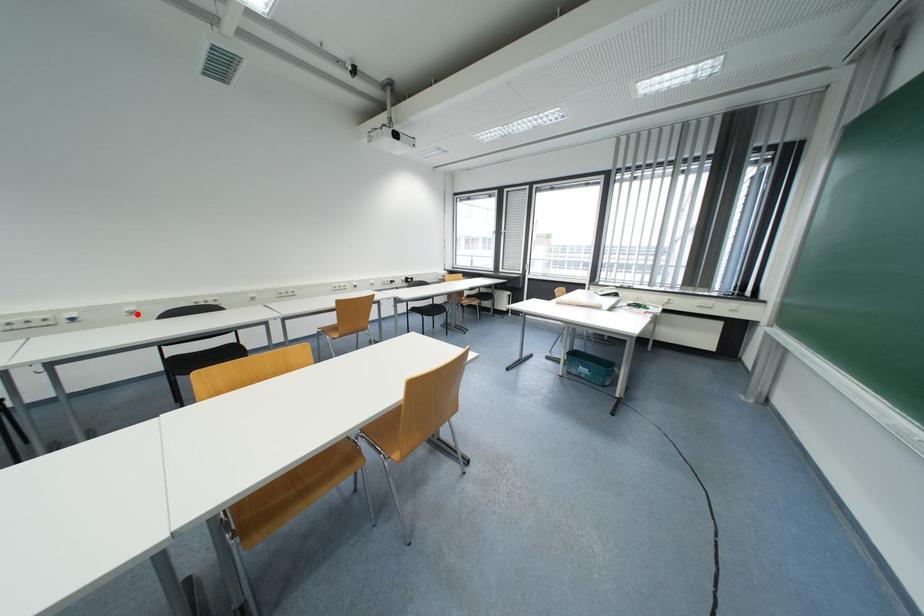
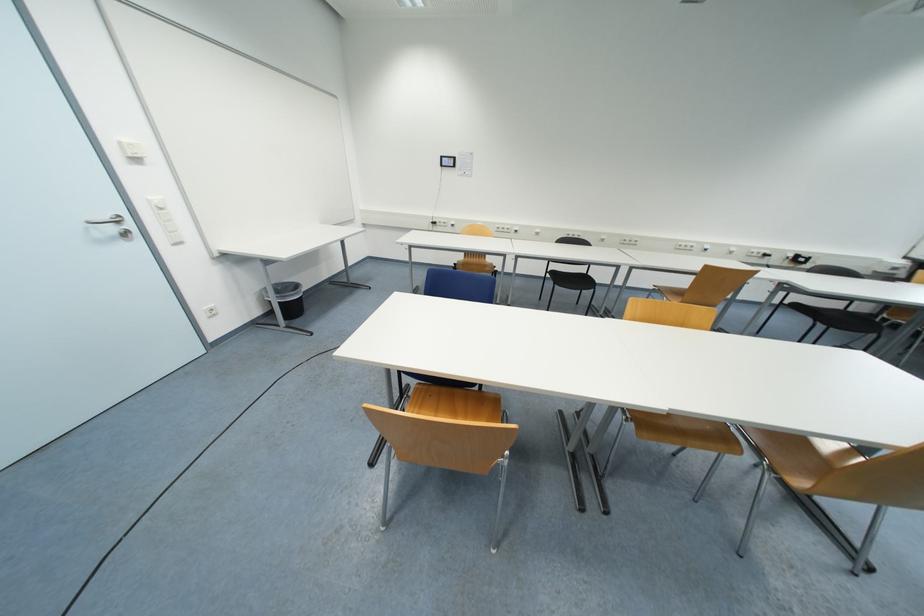
Where in the second image is the point corresponding to the highlighted location from the first image?

(541, 236)